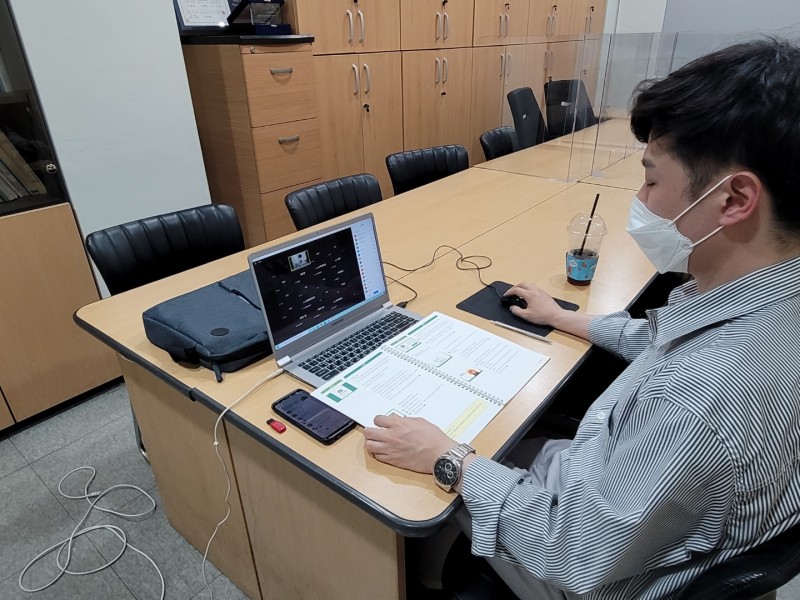
Locate an element on the screen. This screenshot has height=600, width=800. 1 phone is located at coordinates (320, 432).